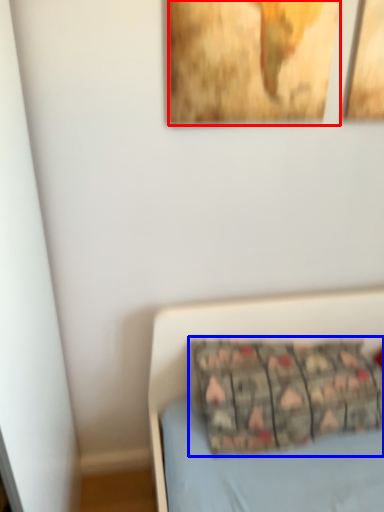
Question: Among these objects, which one is nearest to the camera, picture frame (highlighted by a red box) or pillow (highlighted by a blue box)?

Choices:
 (A) picture frame
 (B) pillow

Answer: (A)